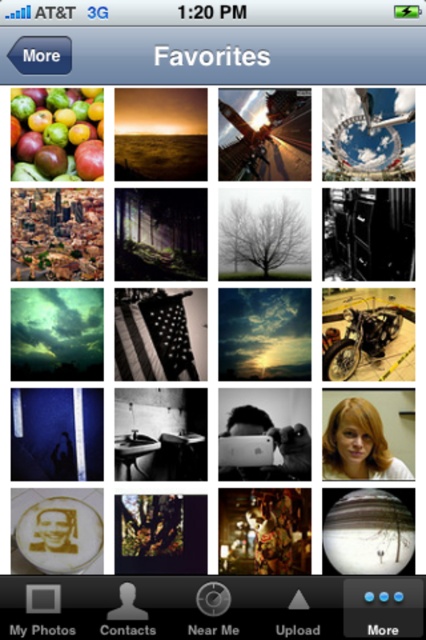
Is blonde hair at center positioned before matte white button at bottom center?

No.

Can you confirm if blonde hair at center is wider than matte white button at bottom center?

Indeed, blonde hair at center has a greater width compared to matte white button at bottom center.

Image resolution: width=426 pixels, height=640 pixels. In order to click on blonde hair at center in this screenshot , I will do `click(357, 444)`.

Where is `blonde hair at center`? blonde hair at center is located at coordinates (357, 444).

Does point (17, 120) come farther from viewer compared to point (48, 628)?

Yes, it is.

Find the location of a particular element. shiny red apples at upper left is located at coordinates (57, 132).

Between point (376, 344) and point (232, 632), which one is positioned in front?

Point (232, 632) is in front.

Is shiny chrome motorcycle at center right below black glossy text at bottom center?

No.

Who is more distant from viewer, (342, 289) or (233, 630)?

Positioned behind is point (342, 289).

Locate an element on the screen. shiny chrome motorcycle at center right is located at coordinates (368, 333).